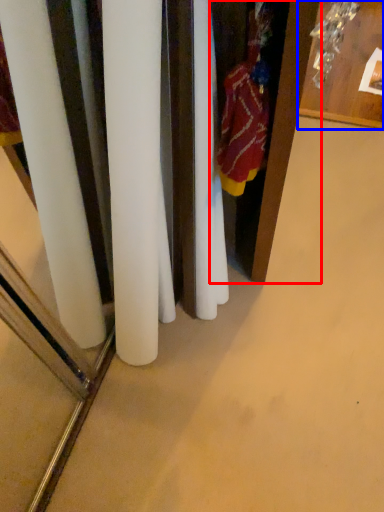
Question: Which point is further to the camera, armoire (highlighted by a red box) or furniture (highlighted by a blue box)?

Choices:
 (A) armoire
 (B) furniture

Answer: (B)